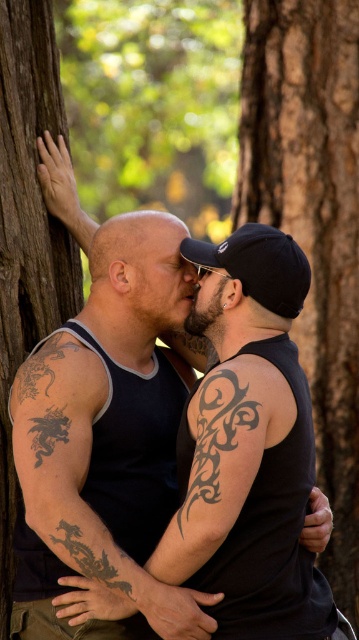
Does black matte tank top at center appear on the left side of bald head at center?

Indeed, black matte tank top at center is positioned on the left side of bald head at center.

Which is behind, point (154, 440) or point (174, 252)?

Positioned behind is point (174, 252).

Is point (184, 600) positioned before point (126, 259)?

Yes, point (184, 600) is in front of point (126, 259).

Locate an element on the screen. This screenshot has width=359, height=640. black matte tank top at center is located at coordinates (104, 448).

Is point (332, 321) behind point (117, 220)?

Yes, point (332, 321) is farther from viewer.

Does brown rough bark at center have a larger size compared to bald head at center?

Yes, brown rough bark at center is bigger than bald head at center.

The width and height of the screenshot is (359, 640). I want to click on brown rough bark at center, so click(313, 224).

Which is behind, point (86, 458) or point (44, 355)?

Point (44, 355)

Is black matte tank top at center to the left of tattooed skin at center from the viewer's perspective?

Indeed, black matte tank top at center is positioned on the left side of tattooed skin at center.

The height and width of the screenshot is (640, 359). What do you see at coordinates (104, 448) in the screenshot?
I see `black matte tank top at center` at bounding box center [104, 448].

This screenshot has height=640, width=359. Find the location of `black matte tank top at center`. black matte tank top at center is located at coordinates (104, 448).